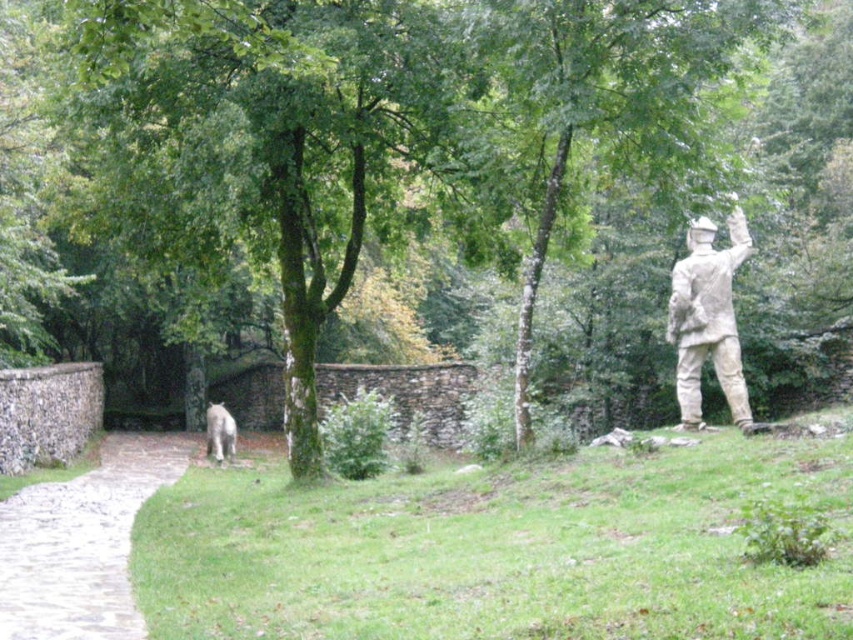
Does cobblestone path at lower left have a greater width compared to stone statue at right?

Yes.

Who is more distant from viewer, (x=122, y=486) or (x=722, y=339)?

The point (x=122, y=486) is more distant.

You are a GUI agent. You are given a task and a screenshot of the screen. Output one action in this format:
    pyautogui.click(x=<x>, y=<y>)
    Task: Click on the cobblestone path at lower left
    
    Given the screenshot: What is the action you would take?
    (82, 541)

Based on the photo, how much distance is there between stone statue at right and white fur dog at lower left?

stone statue at right and white fur dog at lower left are 42.08 feet apart.

From the picture: Is stone statue at right smaller than white fur dog at lower left?

Correct, stone statue at right occupies less space than white fur dog at lower left.

Which is in front, point (689, 394) or point (210, 436)?

Point (689, 394) is in front.

Locate an element on the screen. Image resolution: width=853 pixels, height=640 pixels. stone statue at right is located at coordinates (706, 320).

Is green grassy at lower center positioned behind white fur dog at lower left?

No, it is in front of white fur dog at lower left.

Who is higher up, green grassy at lower center or white fur dog at lower left?

green grassy at lower center

Is point (366, 573) positioned after point (213, 428)?

No, (366, 573) is closer to viewer.

You are a GUI agent. You are given a task and a screenshot of the screen. Output one action in this format:
    pyautogui.click(x=<x>, y=<y>)
    Task: Click on the green grassy at lower center
    The image size is (853, 640).
    Given the screenshot: What is the action you would take?
    pyautogui.click(x=498, y=550)